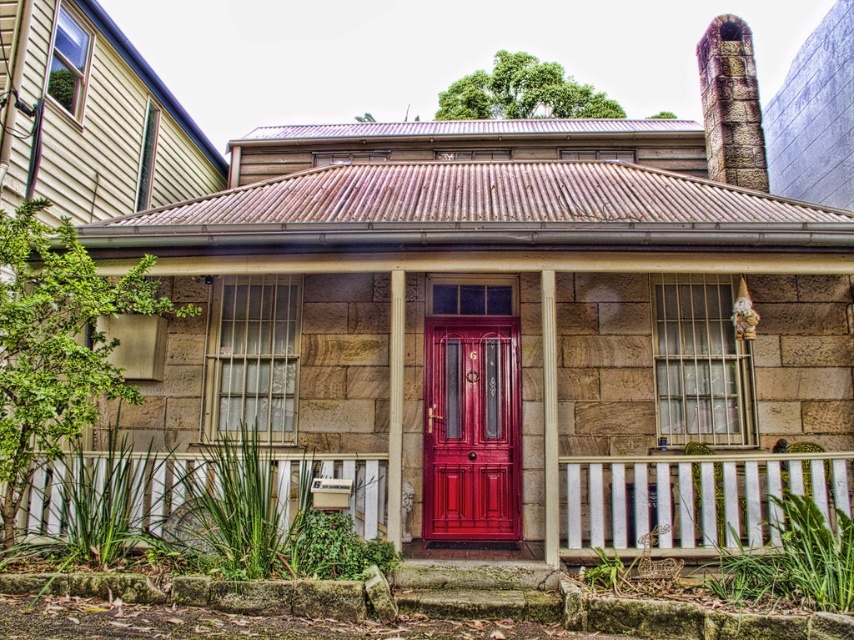
You are standing at the entrance of the house and want to step onto the smooth wooden porch at center. Based on its position coordinates, can you determine if the porch is directly in front of you or to the side?

The smooth wooden porch at center is located at coordinates point (693,499), which suggests it is positioned centrally in front of the entrance, so it is directly in front of you.